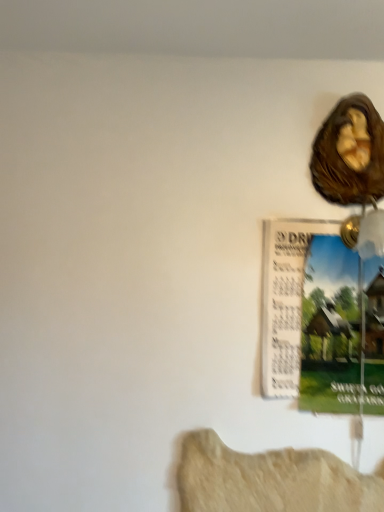
This screenshot has height=512, width=384. What do you see at coordinates (350, 153) in the screenshot? I see `brown textured shell at upper right` at bounding box center [350, 153].

At what (x,y) coordinates should I click in order to perform the action: click on brown textured shell at upper right. Please return your answer as a coordinate pair (x, y). The height and width of the screenshot is (512, 384). Looking at the image, I should click on (350, 153).

Describe the element at coordinates (330, 328) in the screenshot. This screenshot has height=512, width=384. I see `matte paper poster at upper right` at that location.

Locate an element on the screen. The image size is (384, 512). matte paper poster at upper right is located at coordinates (330, 328).

In order to face matte paper poster at upper right, should I rotate leftwards or rightwards?

Rotate right and turn 20.027 degrees.

The height and width of the screenshot is (512, 384). Find the location of `brown textured shell at upper right`. brown textured shell at upper right is located at coordinates (350, 153).

Is matte paper poster at upper right at the left side of brown textured shell at upper right?

Yes.

Considering the positions of objects matte paper poster at upper right and brown textured shell at upper right in the image provided, who is behind, matte paper poster at upper right or brown textured shell at upper right?

brown textured shell at upper right is behind.

Between point (337, 346) and point (324, 128), which one is positioned in front?

The point (337, 346) is closer.

From the picture: From the image's perspective, is matte paper poster at upper right located above or below brown textured shell at upper right?

Clearly, from the image's perspective, matte paper poster at upper right is below brown textured shell at upper right.

From a real-world perspective, is matte paper poster at upper right beneath brown textured shell at upper right?

Yes, from a real-world perspective, matte paper poster at upper right is under brown textured shell at upper right.

Considering the sizes of objects matte paper poster at upper right and brown textured shell at upper right in the image provided, who is thinner, matte paper poster at upper right or brown textured shell at upper right?

With smaller width is matte paper poster at upper right.

Does matte paper poster at upper right have a lesser height compared to brown textured shell at upper right?

Incorrect, the height of matte paper poster at upper right does not fall short of that of brown textured shell at upper right.

Does matte paper poster at upper right have a smaller size compared to brown textured shell at upper right?

No.

Is matte paper poster at upper right not within brown textured shell at upper right?

Indeed, matte paper poster at upper right is completely outside brown textured shell at upper right.

Are matte paper poster at upper right and brown textured shell at upper right making contact?

matte paper poster at upper right and brown textured shell at upper right are not in contact.

Is matte paper poster at upper right oriented towards brown textured shell at upper right?

No, matte paper poster at upper right is not facing towards brown textured shell at upper right.

How many degrees apart are the facing directions of matte paper poster at upper right and brown textured shell at upper right?

0.241 degrees separate the facing orientations of matte paper poster at upper right and brown textured shell at upper right.

I want to click on poster page on the left of brown textured shell at upper right, so click(330, 328).

Between brown textured shell at upper right and matte paper poster at upper right, which one appears on the right side from the viewer's perspective?

brown textured shell at upper right is more to the right.

Which object is further away from the camera, brown textured shell at upper right or matte paper poster at upper right?

Positioned behind is brown textured shell at upper right.

Between point (324, 177) and point (310, 281), which one is positioned in front?

The point (310, 281) is closer to the camera.

From the image's perspective, between brown textured shell at upper right and matte paper poster at upper right, who is located below?

matte paper poster at upper right appears lower in the image.

From a real-world perspective, is brown textured shell at upper right physically located above or below matte paper poster at upper right?

From a real-world perspective, brown textured shell at upper right is physically above matte paper poster at upper right.

Is brown textured shell at upper right wider than matte paper poster at upper right?

Yes.

Between brown textured shell at upper right and matte paper poster at upper right, which one has more height?

matte paper poster at upper right.

Considering the relative sizes of brown textured shell at upper right and matte paper poster at upper right in the image provided, is brown textured shell at upper right smaller than matte paper poster at upper right?

Yes, brown textured shell at upper right is smaller than matte paper poster at upper right.

Is brown textured shell at upper right spatially inside matte paper poster at upper right, or outside of it?

brown textured shell at upper right is spatially situated outside matte paper poster at upper right.

Would you say brown textured shell at upper right is a long distance from matte paper poster at upper right?

No, brown textured shell at upper right is not far from matte paper poster at upper right.

Is brown textured shell at upper right looking in the opposite direction of matte paper poster at upper right?

No, matte paper poster at upper right is not at the back of brown textured shell at upper right.

What's the angular difference between brown textured shell at upper right and matte paper poster at upper right's facing directions?

The facing directions of brown textured shell at upper right and matte paper poster at upper right are 0.241 degrees apart.

How distant is brown textured shell at upper right from matte paper poster at upper right?

14.80 inches.

Locate an element on the screen. The image size is (384, 512). poster page to the left of brown textured shell at upper right is located at coordinates (330, 328).

Where is `poster page in front of the brown textured shell at upper right`? poster page in front of the brown textured shell at upper right is located at coordinates (330, 328).

Identify the location of poster page directly beneath the brown textured shell at upper right (from a real-world perspective). The image size is (384, 512). (330, 328).